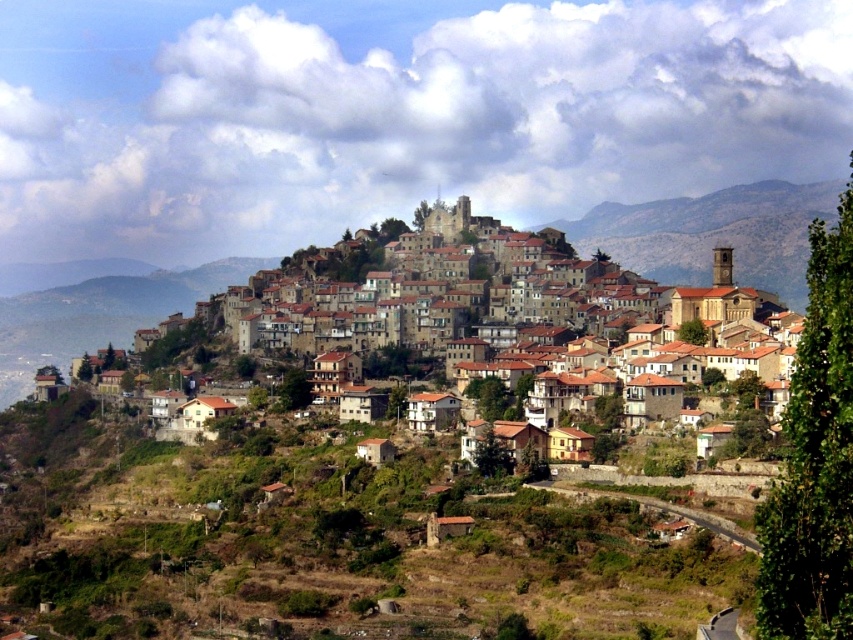
Is brown stone buildings at center shorter than brown rocky mountain at center?

Incorrect, brown stone buildings at center's height does not fall short of brown rocky mountain at center's.

Between brown stone buildings at center and brown rocky mountain at center, which one has more height?

Standing taller between the two is brown stone buildings at center.

Is point (798, 269) less distant than point (653, 259)?

Yes, it is.

The image size is (853, 640). I want to click on brown stone buildings at center, so click(x=711, y=236).